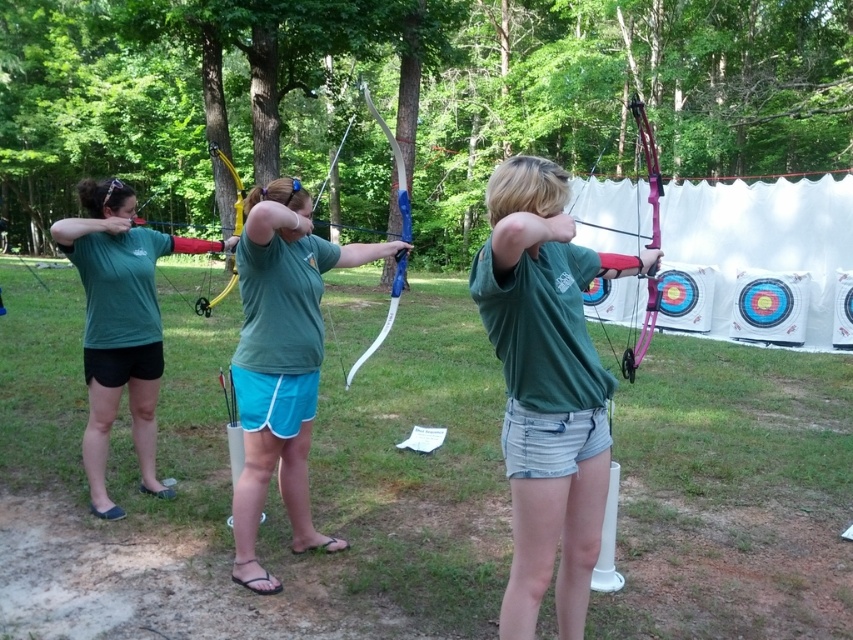
Question: Estimate the real-world distances between objects in this image. Which object is farther from the green matte shirt at center?

Choices:
 (A) pink glossy bow at center
 (B) matte green shirt at center
 (C) matte blue bow at center

Answer: (A)

Question: Which of the following is the closest to the observer?

Choices:
 (A) matte green shirt at center
 (B) green matte shirt at center

Answer: (B)

Question: Which of the following is the farthest from the observer?

Choices:
 (A) green matte shirt at center
 (B) pink glossy bow at center

Answer: (B)

Question: Can you confirm if matte blue bow at center is positioned to the left of matte green shirt at center?

Choices:
 (A) no
 (B) yes

Answer: (A)

Question: Is green matte shirt at center below matte blue bow at center?

Choices:
 (A) no
 (B) yes

Answer: (B)

Question: Does matte green shirt at center lie behind pink glossy bow at center?

Choices:
 (A) yes
 (B) no

Answer: (A)